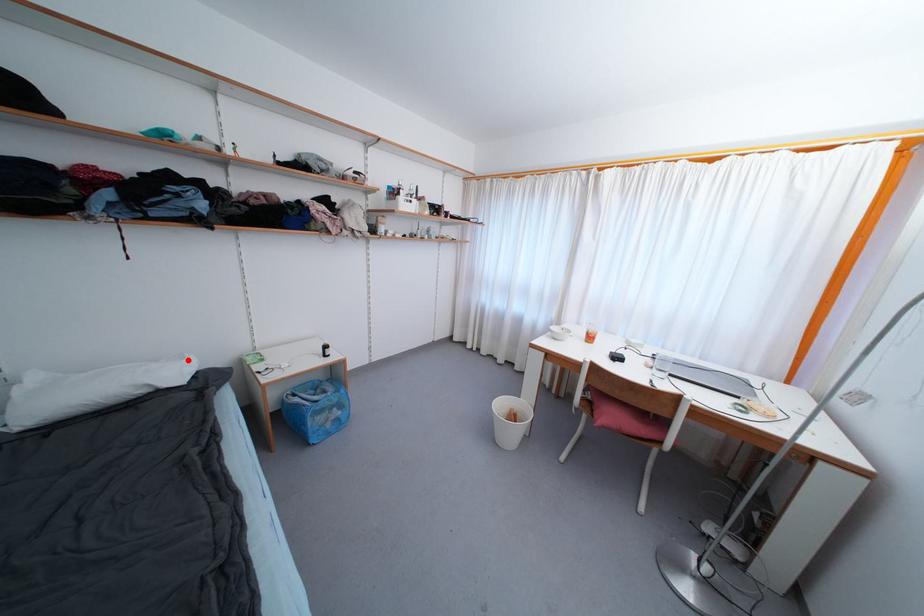
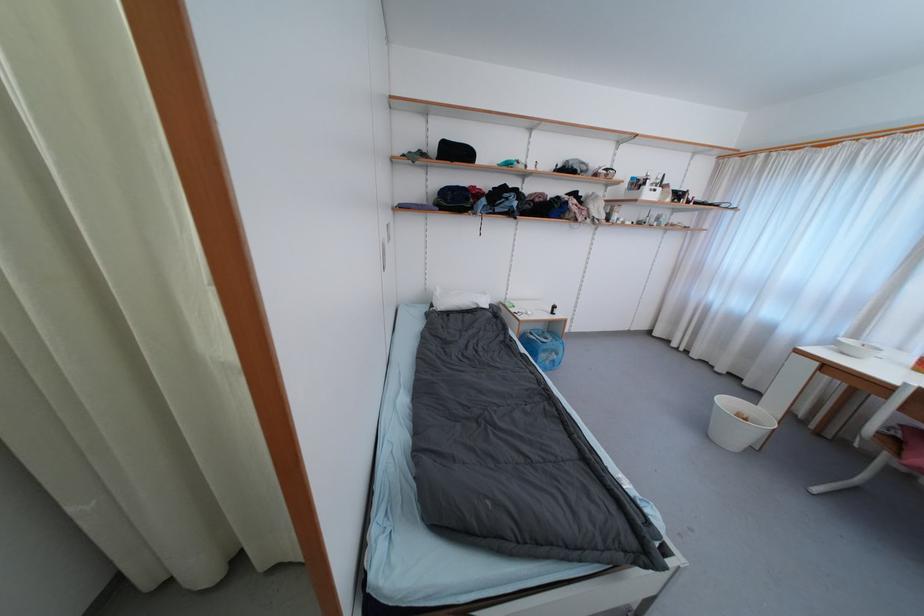
Where in the second image is the point corresponding to the highlighted location from the first image?

(489, 296)